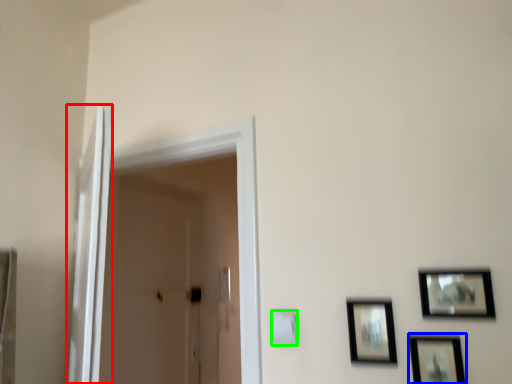
Question: Estimate the real-world distances between objects in this image. Which object is farther from screen door (highlighted by a red box), picture frame (highlighted by a blue box) or light switch (highlighted by a green box)?

Choices:
 (A) picture frame
 (B) light switch

Answer: (A)